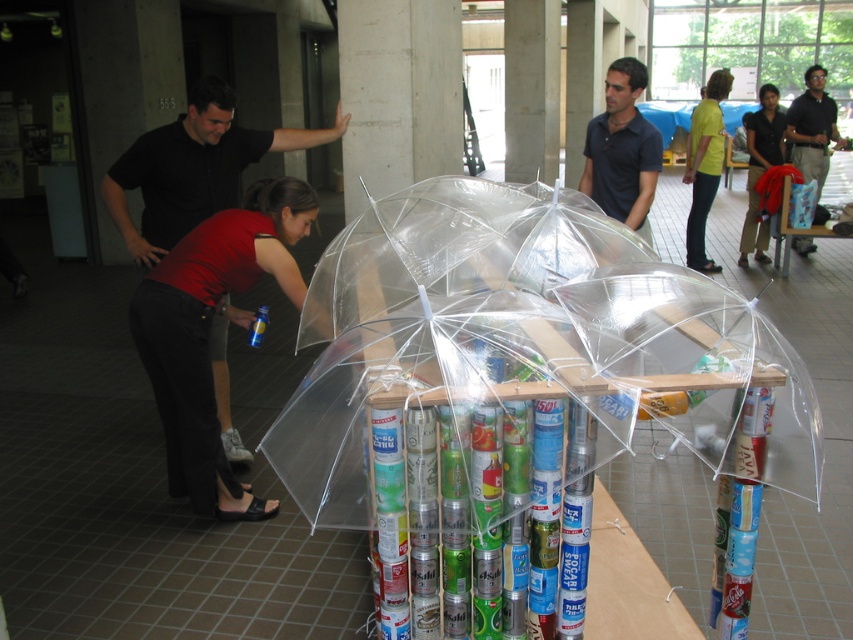
You are standing in the atrium and want to take a photo of the structure. You notice two points marked on the structure at coordinates point (631, 225) and point (810, 116). Which point should you focus on to ensure it appears larger in your photo?

You should focus on point (631, 225) because it is closer to the camera than point (810, 116), so it will appear larger in the photo.

You are organizing a fashion show and need to arrange two models wearing the matte black shirt at center and the black polo shirt at upper right. According to the scene, which model should stand to the left of the other?

The matte black shirt at center should stand to the left of the black polo shirt at upper right because the matte black shirt at center is positioned on the left side of the black polo shirt at upper right in the scene.